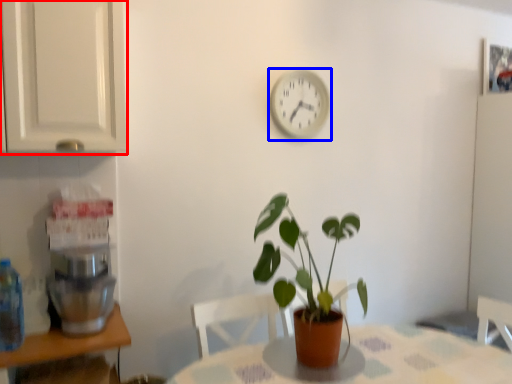
Question: Which object is further to the camera taking this photo, cabinetry (highlighted by a red box) or clock (highlighted by a blue box)?

Choices:
 (A) cabinetry
 (B) clock

Answer: (B)